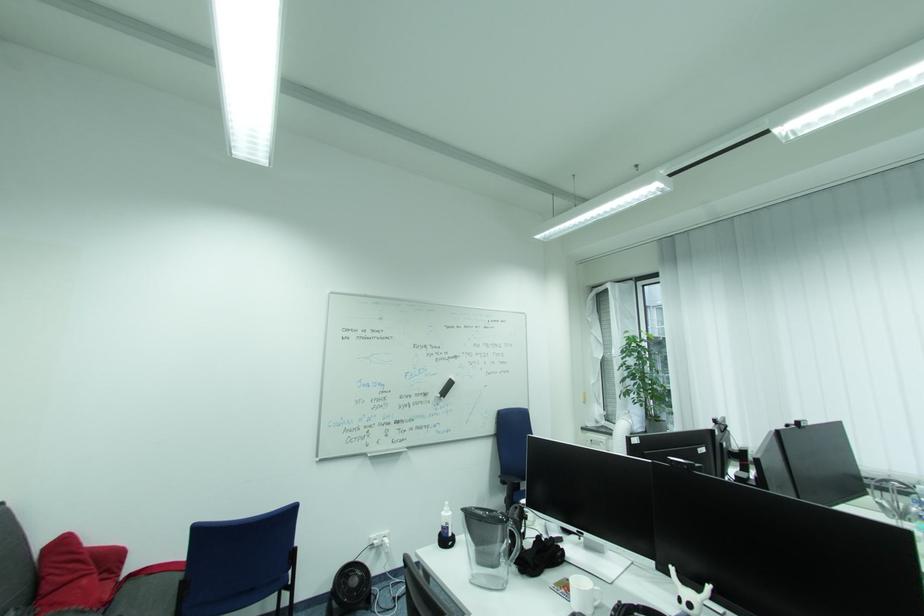
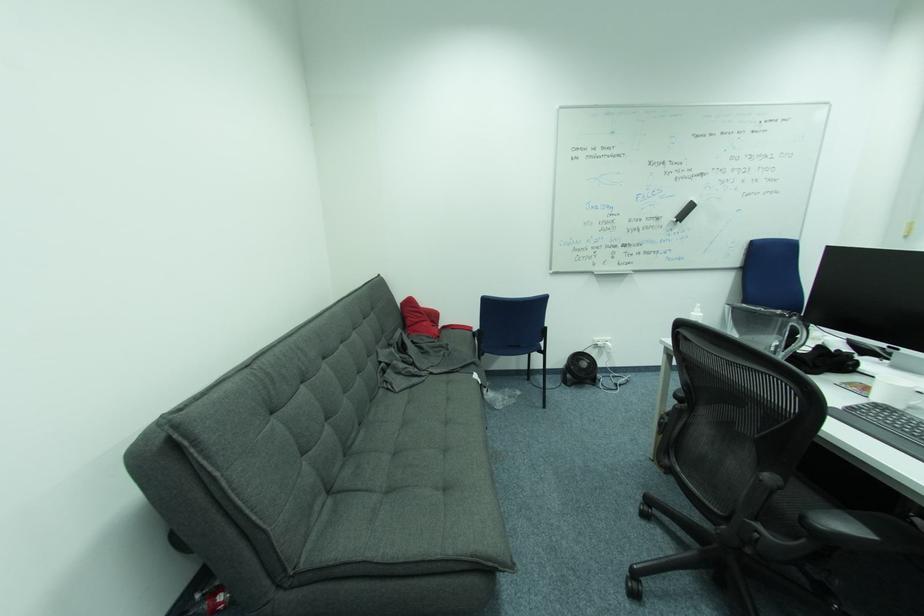
How did the camera likely rotate?

The camera's rotation is toward left-down.